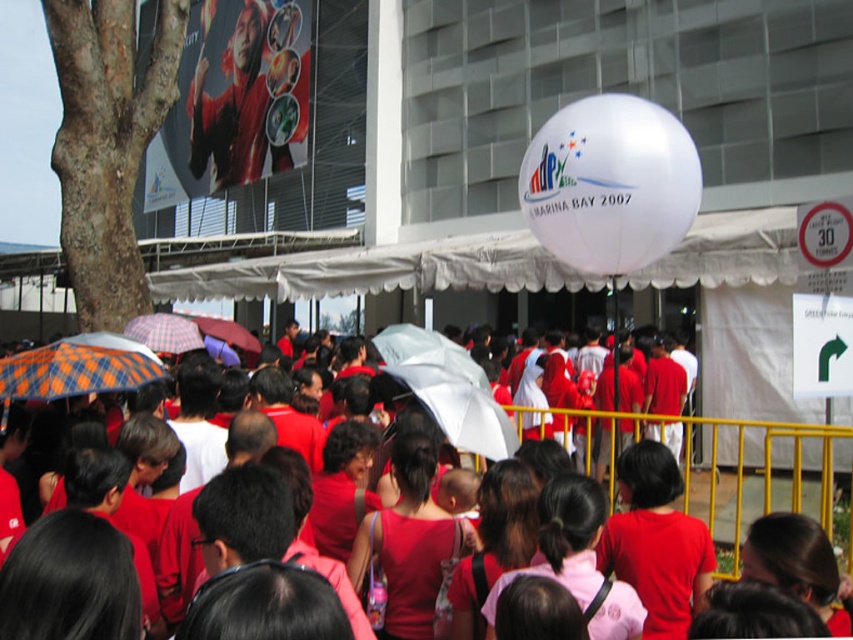
Question: Does matte red shirts at center have a greater width compared to checkered fabric umbrella at left?

Choices:
 (A) yes
 (B) no

Answer: (B)

Question: Which of these objects is positioned farthest from the matte red shirts at center?

Choices:
 (A) checkered fabric umbrella at left
 (B) matte purple umbrella at center
 (C) white matte umbrella at center
 (D) orange plaid fabric umbrella at lower left

Answer: (B)

Question: Is matte red shirts at center wider than matte purple umbrella at center?

Choices:
 (A) no
 (B) yes

Answer: (A)

Question: Considering the relative positions of orange plaid fabric umbrella at lower left and white matte umbrella at center in the image provided, where is orange plaid fabric umbrella at lower left located with respect to white matte umbrella at center?

Choices:
 (A) below
 (B) above

Answer: (B)

Question: Which of the following is the farthest from the observer?

Choices:
 (A) matte purple umbrella at center
 (B) white matte umbrella at center
 (C) matte red shirts at center
 (D) orange plaid fabric umbrella at lower left

Answer: (A)

Question: Which object is the farthest from the matte purple umbrella at center?

Choices:
 (A) checkered fabric umbrella at left
 (B) orange plaid fabric umbrella at lower left
 (C) matte red shirts at center

Answer: (C)